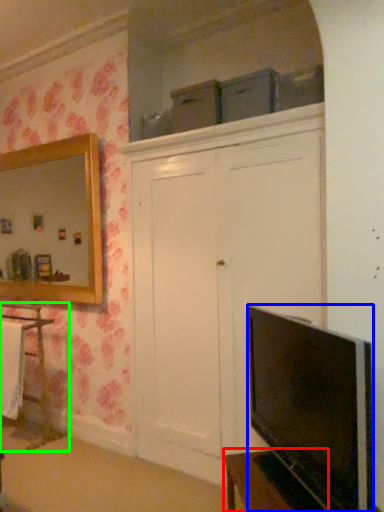
Question: Estimate the real-world distances between objects in this image. Which object is farther from vanity (highlighted by a red box), television (highlighted by a blue box) or cabinetry (highlighted by a green box)?

Choices:
 (A) television
 (B) cabinetry

Answer: (B)